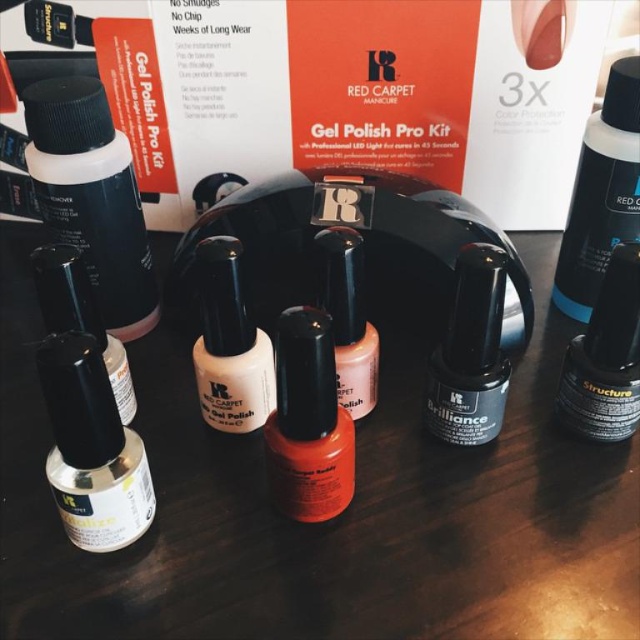
You are a customer at the store looking at the nail care display. There are two points marked on the display, one at coordinate point (317, 428) and another at point (332, 230). Which point is closer to you as you face the display?

Point (317, 428) is closer to the viewer than point (332, 230).

You are organizing a beauty event and need to place the matte black bottle at upper right and the matte black structure at center on a shelf. Given that the shelf has limited space, which object should you place first to ensure both fit?

The matte black structure at center is smaller in size, so you should place it first to accommodate the larger matte black bottle at upper right.

You are organizing a beauty counter and need to place the shiny orange nail polish at center. Where exactly should you position it relative to the other items?

The shiny orange nail polish at center should be positioned at coordinates point (307,420) as specified in the description.